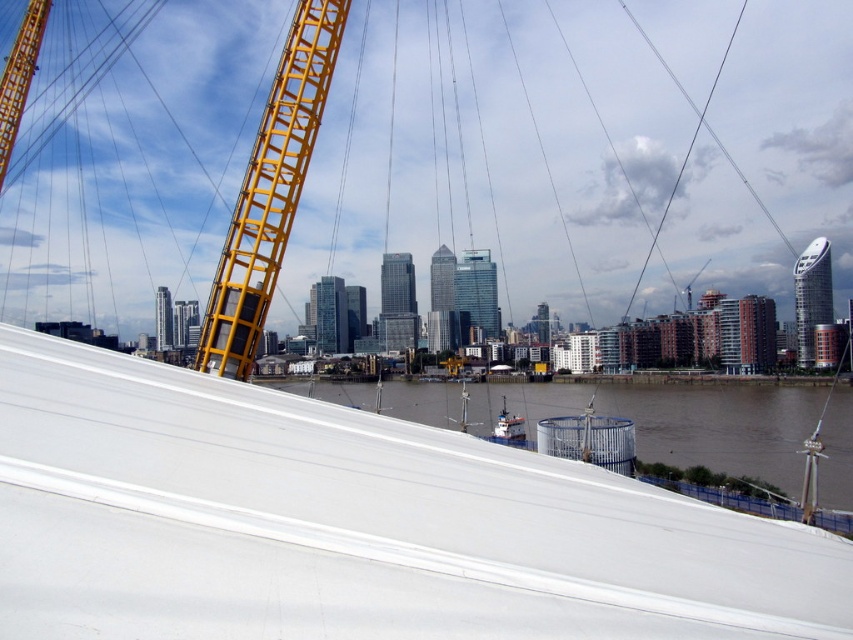
You are standing on the bridge and want to take a photo of the brown matte water at lower center. Based on its coordinates, where should you aim your camera?

The brown matte water at lower center is located at point coordinates 0.667 along the x axis and 0.845 along the y axis, so you should aim your camera towards the lower center area of the frame where those coordinates intersect.

You are a city planner reviewing this bridge design. You need to ensure that the yellow metallic crane at upper left can safely lower materials to the construction site near the brown matte water at lower center. Based on their positions, can the crane reach the water area without obstruction?

The brown matte water at lower center is positioned on the right side of the yellow metallic crane at upper left, meaning the crane is to the left of the water. Since the crane is positioned to the left, it can swing its arm towards the right to lower materials directly onto the brown matte water at lower center without obstruction.

You are an engineer assessing the structural integrity of the yellow metallic structure at left and the yellow metallic crane at upper left. Based on their widths, which one requires more material for stability?

The yellow metallic structure at left is wider than the yellow metallic crane at upper left, so it likely requires more material for stability.